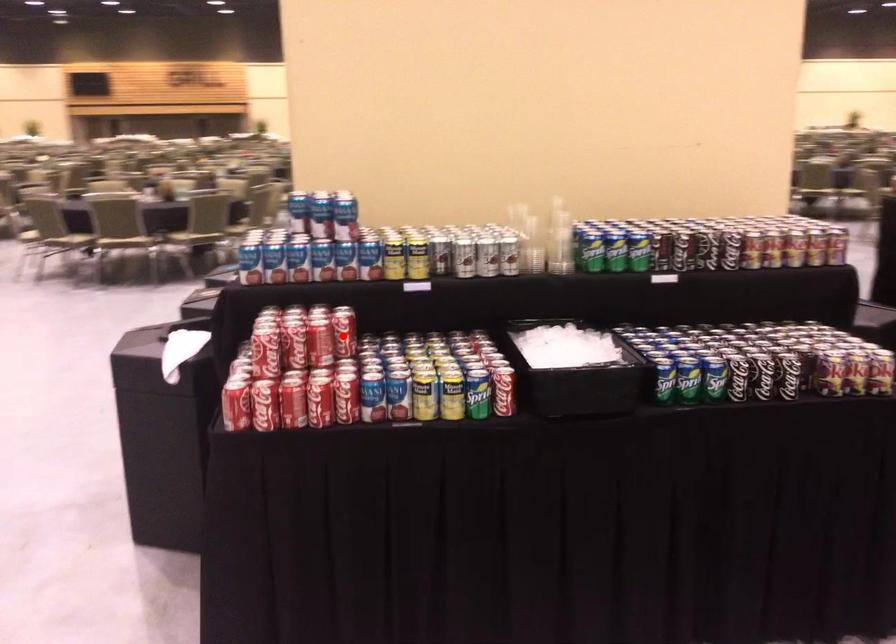
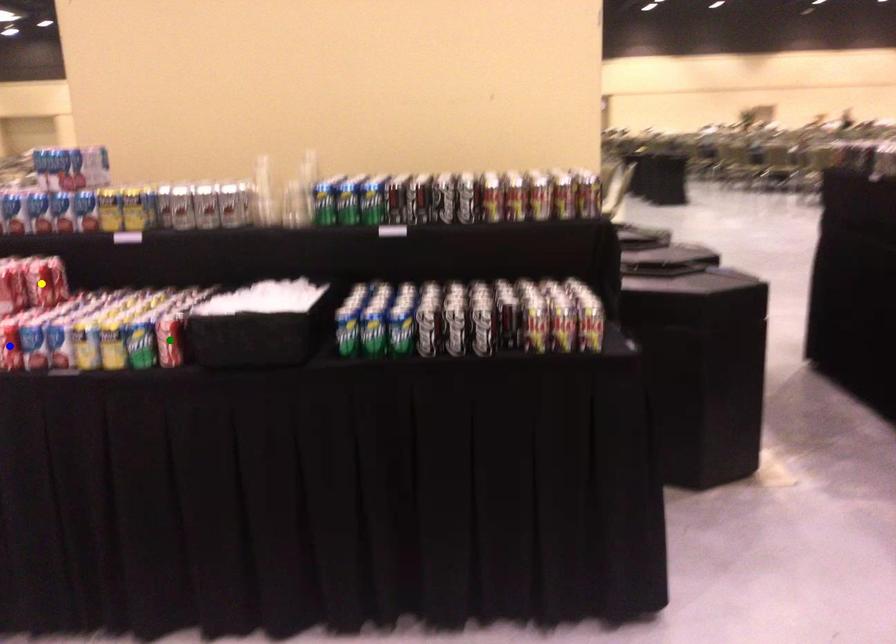
Question: I am providing you with two images of the same scene from different viewpoints. A red point is marked on the first image. You are given multiple points on the second image. Which mark in image 2 goes with the point in image 1?

Choices:
 (A) blue point
 (B) yellow point
 (C) green point

Answer: (B)